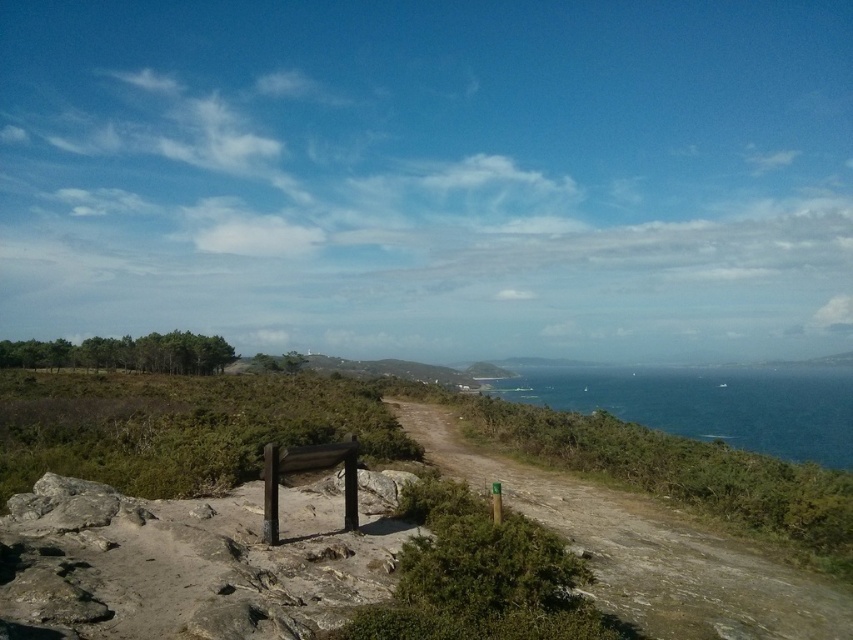
Question: Among these objects, which one is farthest from the camera?

Choices:
 (A) blue glossy water at right
 (B) dirt path at center

Answer: (A)

Question: Does dirt path at center appear under blue glossy water at right?

Choices:
 (A) no
 (B) yes

Answer: (A)

Question: Where is dirt path at center located in relation to blue glossy water at right in the image?

Choices:
 (A) above
 (B) below

Answer: (A)

Question: Does dirt path at center lie behind blue glossy water at right?

Choices:
 (A) yes
 (B) no

Answer: (B)

Question: Among these points, which one is nearest to the camera?

Choices:
 (A) (492, 452)
 (B) (502, 387)

Answer: (A)